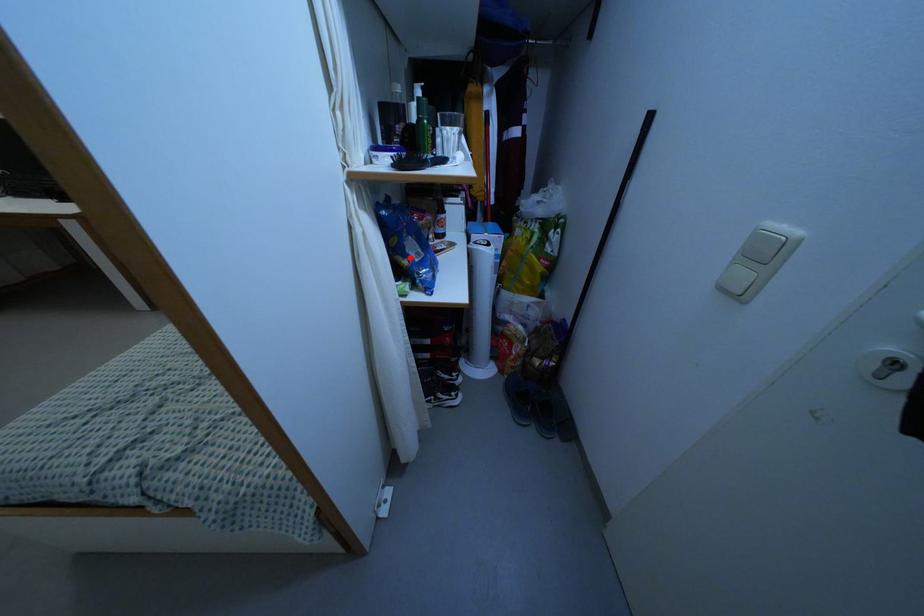
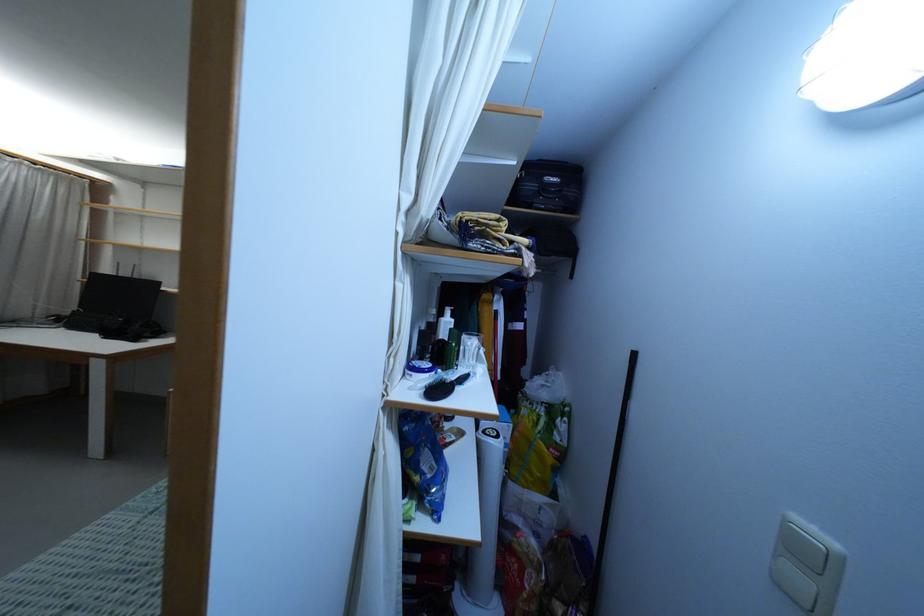
Locate, in the second image, the point that corresponds to the highlighted location in the first image.

(422, 474)